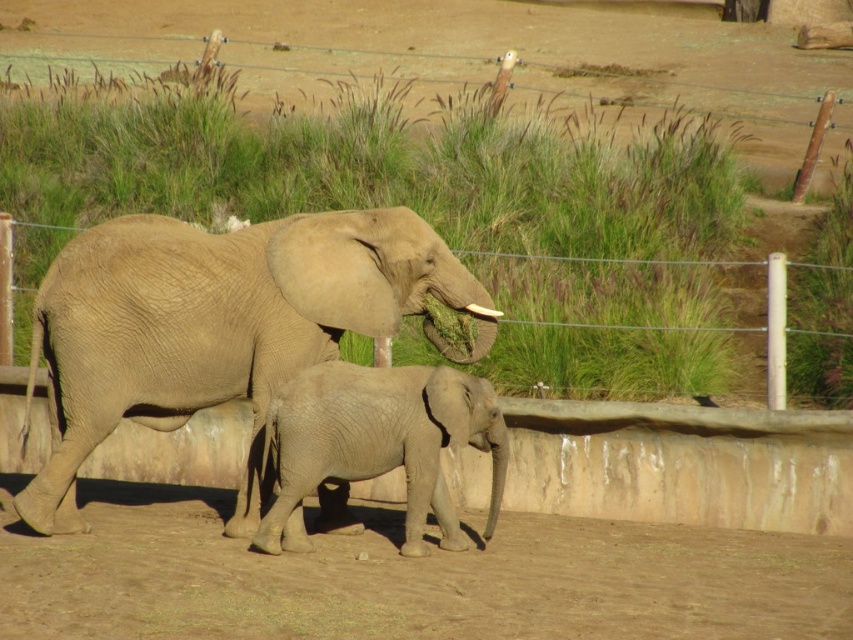
You are standing in the zoo enclosure looking at the gray textured elephant at center. If you walk straight ahead, will you eventually see the wire fence or the concrete wall first?

The concrete wall is closer to the gray textured elephant at center than the wire fence, so you will see the concrete wall first.

You are standing at the point marked by the coordinates point (218, 326). Looking around, you see the gray textured elephant at center. Which direction should you walk to reach the gray textured elephant at center?

You are already at the point marked by the coordinates point (218, 326), which marks the location of the gray textured elephant at center, so you don not need to move.

You are standing in front of the zoo enclosure looking at the two elephants. There are two points marked in the image. The first point is at coordinate point [328,237] and the second is at point [1,358]. Which point is closer to you?

Point [328,237] is closer to the viewer than point [1,358].